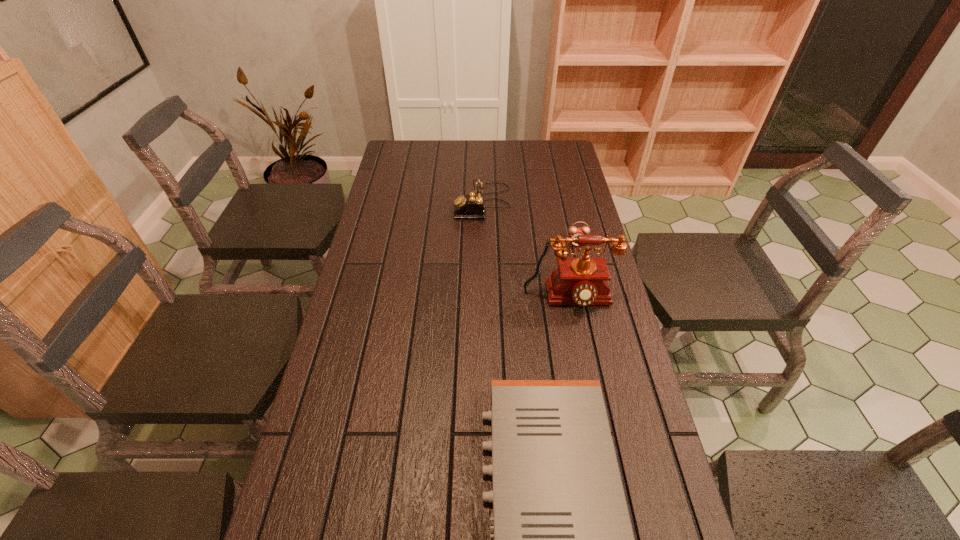
This screenshot has height=540, width=960. What are the coordinates of `telephone located in the right edge section of the desktop` in the screenshot? It's located at (582, 281).

Where is `alarm clock that is at the right edge`? The height and width of the screenshot is (540, 960). alarm clock that is at the right edge is located at coordinates (573, 230).

In the image, there is a desktop. Where is `free space at the far edge`? The height and width of the screenshot is (540, 960). free space at the far edge is located at coordinates (524, 153).

You are a GUI agent. You are given a task and a screenshot of the screen. Output one action in this format:
    pyautogui.click(x=<x>, y=<y>)
    Task: Click on the free point at the left edge
    The height and width of the screenshot is (540, 960).
    Given the screenshot: What is the action you would take?
    pyautogui.click(x=313, y=440)

At what (x,y) coordinates should I click in order to perform the action: click on vacant space at the right edge. Please return your answer as a coordinate pair (x, y). Looking at the image, I should click on (626, 433).

Locate an element on the screen. Image resolution: width=960 pixels, height=540 pixels. free spot between the alarm clock and the farthest object is located at coordinates (530, 223).

The image size is (960, 540). In order to click on free space that is in between the alarm clock and the farthest object in this screenshot , I will do `click(530, 223)`.

This screenshot has height=540, width=960. Identify the location of free space between the farthest object and the alarm clock. (530, 223).

Identify which object is the second closest to the farther telephone. Please provide its 2D coordinates. Your answer should be formatted as a tuple, i.e. [(x, y)], where the tuple contains the x and y coordinates of a point satisfying the conditions above.

[(582, 281)]

Locate which object ranks in proximity to the alarm clock. Please provide its 2D coordinates. Your answer should be formatted as a tuple, i.e. [(x, y)], where the tuple contains the x and y coordinates of a point satisfying the conditions above.

[(582, 281)]